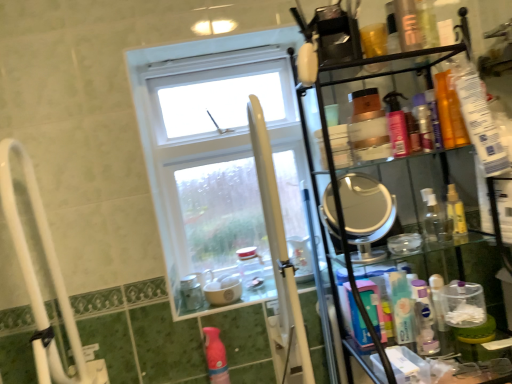
Question: Considering the positions of point (242, 256) and point (375, 312), is point (242, 256) closer or farther from the camera than point (375, 312)?

Choices:
 (A) farther
 (B) closer

Answer: (A)

Question: In terms of size, does clear glass jar at center, the second bottle in the front-to-back sequence, appear bigger or smaller than blue plastic mouthwash at right, arranged as the 1th mouthwash when viewed from the left?

Choices:
 (A) big
 (B) small

Answer: (A)

Question: Which of these objects is positioned farthest from the pink matte bottle at lower center?

Choices:
 (A) blue plastic mouthwash at right, the 1th mouthwash from the bottom
 (B) clear glass jar at center, which is the first bottle in back-to-front order
 (C) shiny orange bottle at upper right, the 1th toiletry from the front
 (D) white glass window at center
 (E) pink glossy mouthwash at upper right, the 2th mouthwash in the left-to-right sequence

Answer: (C)

Question: Which object is positioned closest to the translucent orange bottle at upper right, positioned as the first mouthwash in top-to-bottom order?

Choices:
 (A) shiny orange bottle at upper right, the 2th toiletry viewed from the back
 (B) white plastic pole at center
 (C) metallic silver jar at lower center, the first bottle when ordered from left to right
 (D) clear plastic bottle at right, the third mouthwash when ordered from bottom to top
 (E) translucent plastic bottle at upper right, the second toiletry when ordered from front to back

Answer: (A)